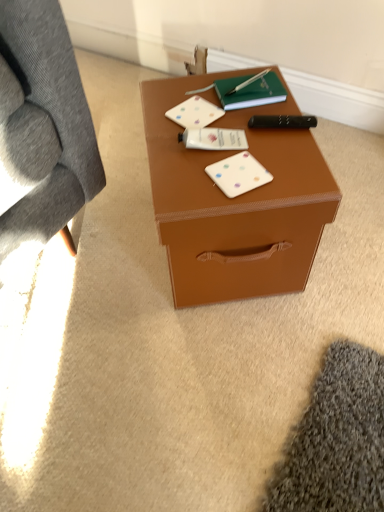
The width and height of the screenshot is (384, 512). Identify the location of vacant space that's between black plastic remote control at right and white matte card game at center, placed as the 2th card game when sorted from top to bottom. (267, 150).